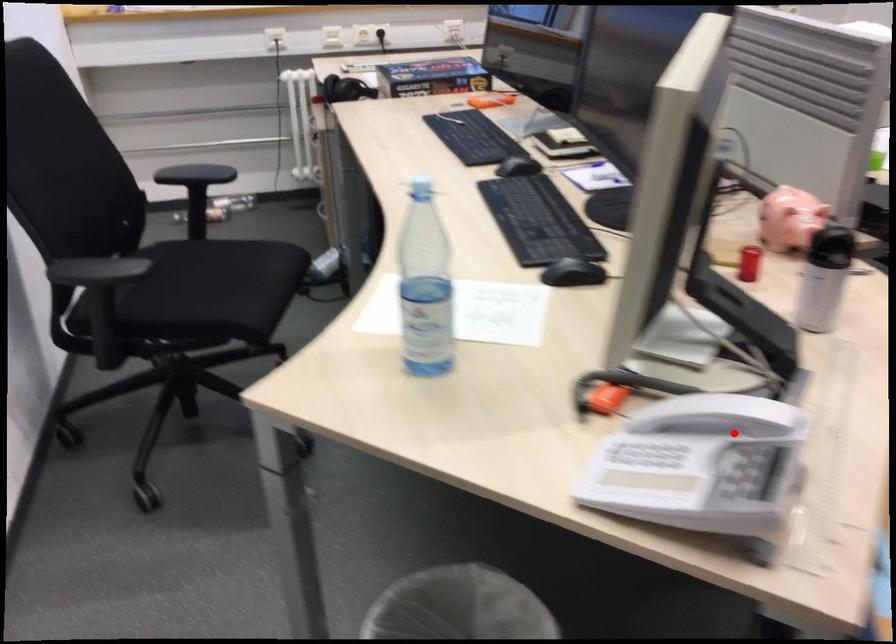
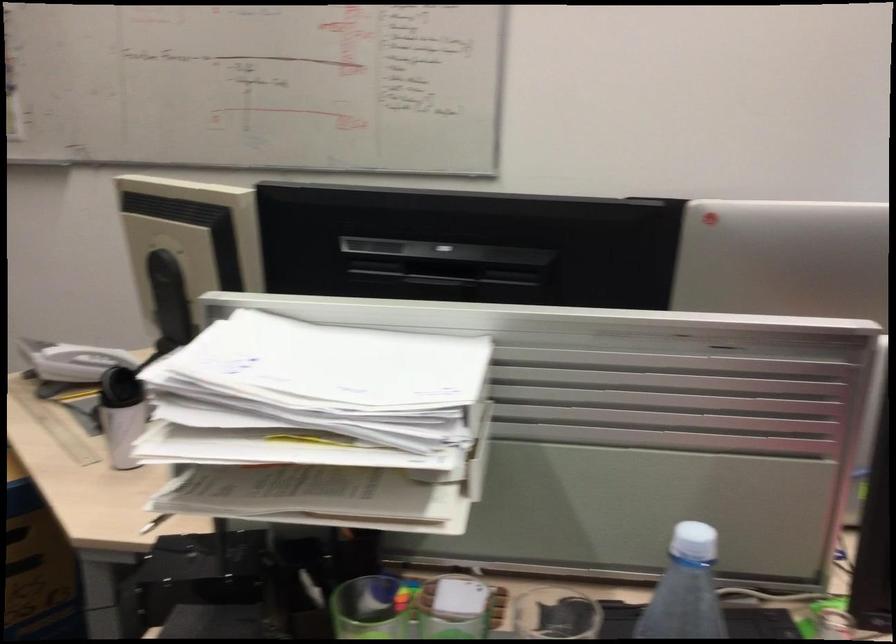
Question: I am providing you with two images of the same scene from different viewpoints. Image1 has a red point marked. In image2, the corresponding 3D location appears at what relative position? Reply with the corresponding letter.

Choices:
 (A) Closer
 (B) Farther

Answer: (B)